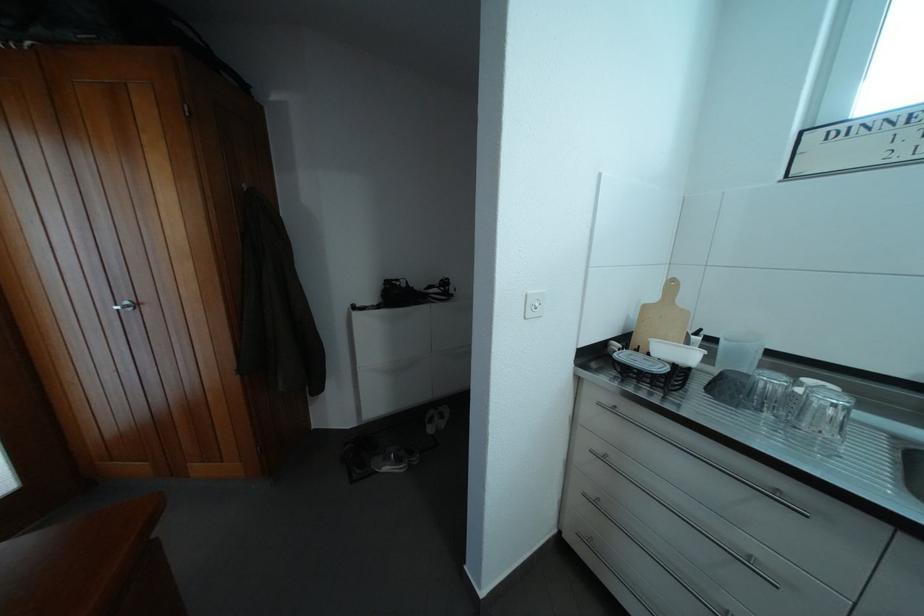
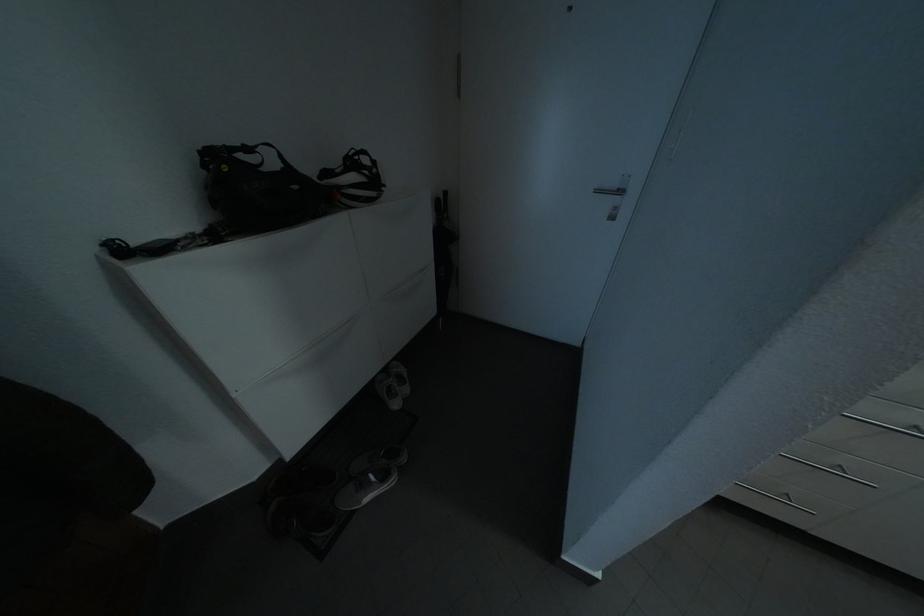
The images are taken continuously from a first-person perspective. In which direction is your viewpoint rotating?

The camera's rotation is toward right-down.